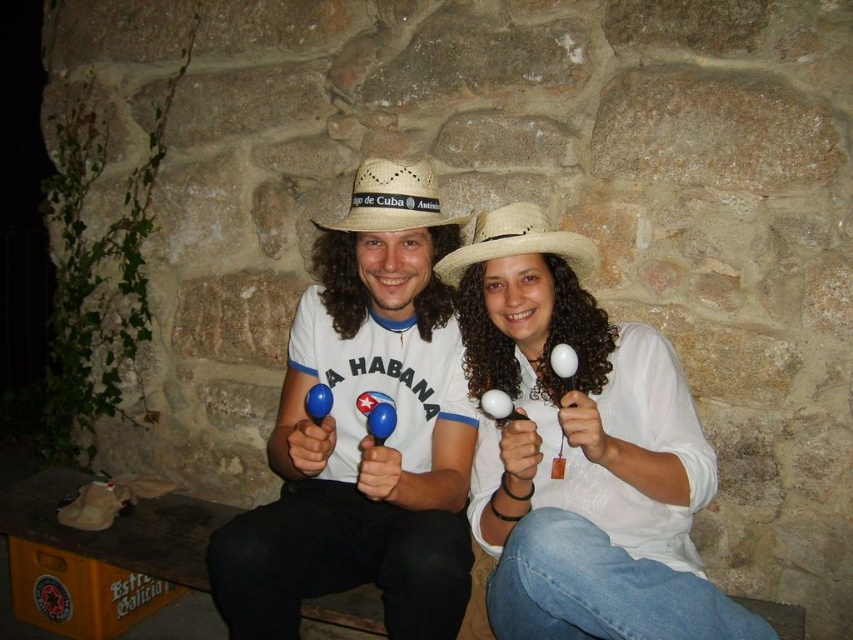
Question: Which of the following is the closest to the observer?

Choices:
 (A) natural straw cowboy hat at center
 (B) white matte maracas at center

Answer: (B)

Question: Which point is closer to the camera taking this photo?

Choices:
 (A) (518, 243)
 (B) (463, 266)
 (C) (428, 163)
 (D) (659, 630)

Answer: (D)

Question: Is white matte maracas at center wider than matte white shirt at center?

Choices:
 (A) no
 (B) yes

Answer: (B)

Question: Which object is farther from the camera taking this photo?

Choices:
 (A) white matte maracas at center
 (B) matte white shirt at center
 (C) natural straw cowboy hat at center

Answer: (C)

Question: Can you confirm if white woven straw sombrero at center is positioned to the right of natural straw cowboy hat at center?

Choices:
 (A) yes
 (B) no

Answer: (B)

Question: Can you confirm if matte white shirt at center is positioned below natural straw cowboy hat at center?

Choices:
 (A) no
 (B) yes

Answer: (B)